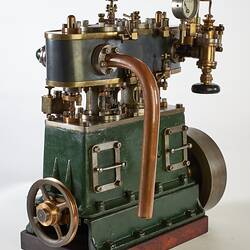
The image size is (250, 250). What are the coordinates of `floor` in the screenshot? It's located at (234, 244).